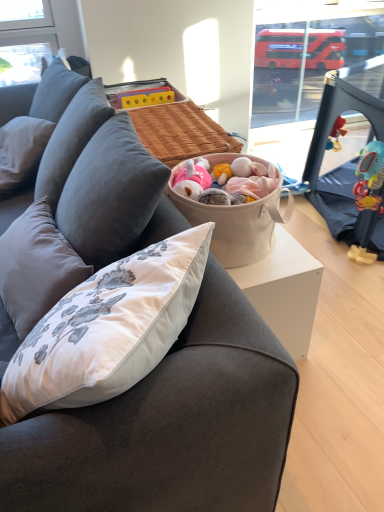
Question: Looking at the image, does gray fabric pillow at left seem bigger or smaller compared to transparent plastic window screen at upper right?

Choices:
 (A) big
 (B) small

Answer: (B)

Question: Is point (23, 168) positioned closer to the camera than point (278, 64)?

Choices:
 (A) closer
 (B) farther

Answer: (A)

Question: Which object is positioned closest to the beige fabric basket at center?

Choices:
 (A) transparent plastic window screen at upper right
 (B) gray fabric pillow at left
 (C) dark gray fabric couch at center

Answer: (C)

Question: Which object is positioned farthest from the dark gray fabric couch at center?

Choices:
 (A) beige fabric basket at center
 (B) gray fabric pillow at left
 (C) transparent plastic window screen at upper right

Answer: (C)